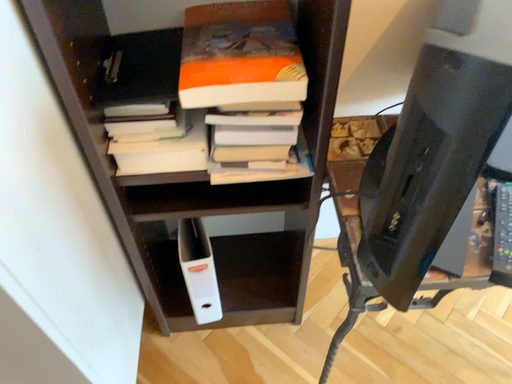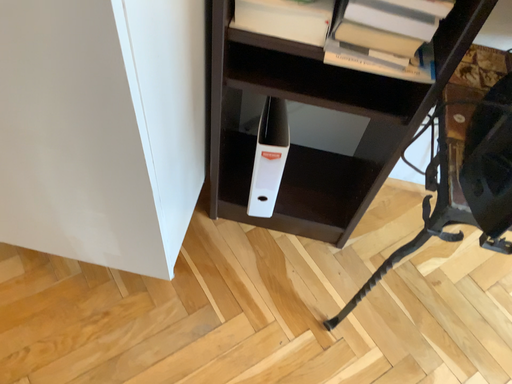
Question: Which way did the camera rotate in the video?

Choices:
 (A) rotated upward
 (B) rotated downward

Answer: (B)